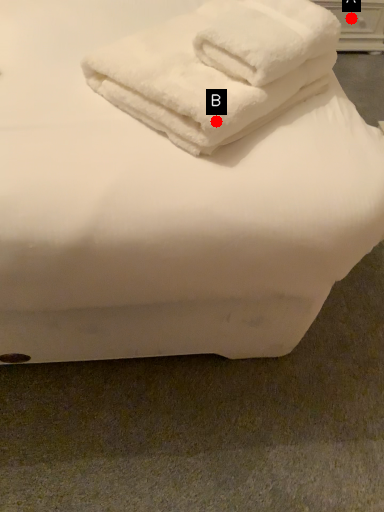
Question: Two points are circled on the image, labeled by A and B beside each circle. Which point appears farthest from the camera in this image?

Choices:
 (A) A is further
 (B) B is further

Answer: (A)